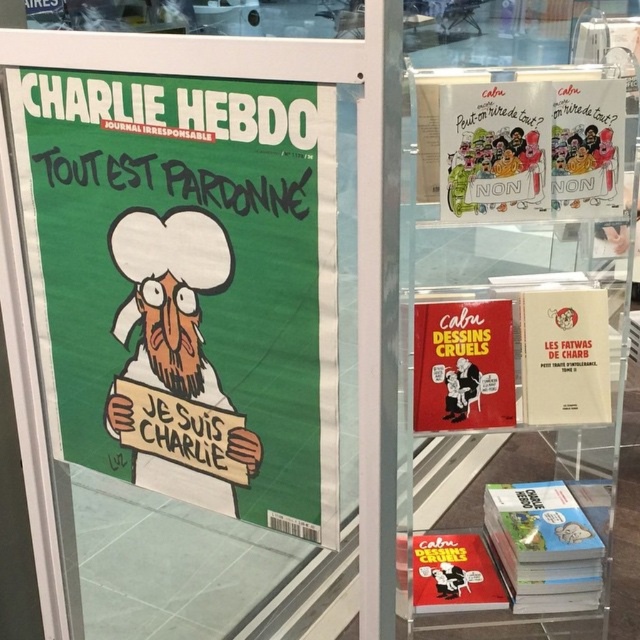
Between green matte poster at left and white paper book at center, which one appears on the left side from the viewer's perspective?

green matte poster at left is more to the left.

I want to click on green matte poster at left, so click(x=188, y=284).

Between point (538, 397) and point (595, 97), which one is positioned behind?

The point (538, 397) is behind.

Can you confirm if white paper book at center is thinner than matte paper poster at upper right?

Incorrect, white paper book at center's width is not less than matte paper poster at upper right's.

Measure the distance between point (x=529, y=330) and camera.

Point (x=529, y=330) and camera are 1.62 meters apart from each other.

Locate an element on the screen. The image size is (640, 640). white paper book at center is located at coordinates (564, 355).

Is point (525, 109) in front of point (552, 380)?

That is True.

Between point (467, 88) and point (586, 412), which one is positioned in front?

Point (467, 88) is more forward.

Which is behind, point (467, 173) or point (566, 308)?

The point (566, 308) is more distant.

What are the coordinates of `matte paper poster at upper center` in the screenshot? It's located at (493, 150).